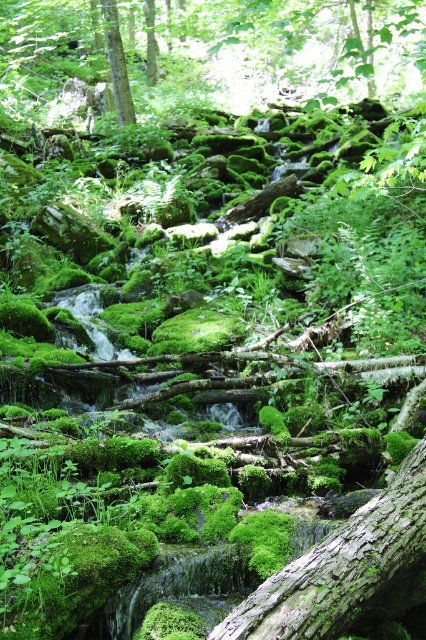
You are a hiker who wants to cross the stream using the green mossy log at center. However, you notice the green mossy tree at upper center nearby. Which object is positioned higher in the image?

The green mossy tree at upper center is positioned higher in the image than the green mossy log at center.

You are a hiker who wants to cross the stream using the green mossy log at center and the green mossy tree at upper center as landmarks. Which object is shorter and better for stepping on?

The green mossy log at center is shorter than the green mossy tree at upper center, making it better for stepping on when crossing the stream.